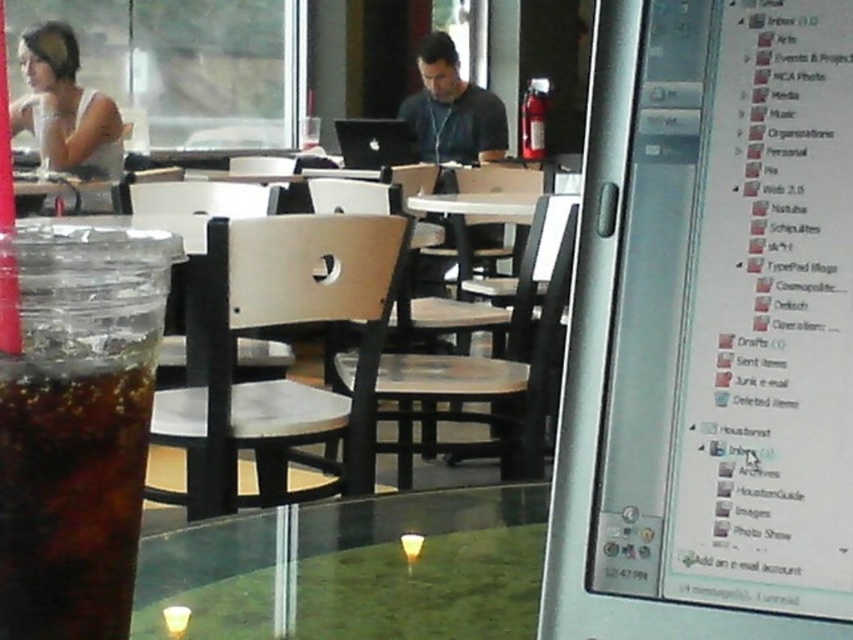
You are a customer sitting at the transparent glass table at center in a cafe. You notice a matte white shirt at upper left. Which object is closer to the ceiling?

The matte white shirt at upper left is closer to the ceiling because the transparent glass table at center is shorter than the matte white shirt at upper left.

You are sitting at the transparent glass table at center and want to wave to the person wearing the matte white shirt at upper left. In which direction should you wave your hand to face them?

You should wave your hand to the left because the transparent glass table at center is to the right of the matte white shirt at upper left, so the person is to your left.

You are a customer at the cafe and want to place your phone on the transparent glass table at center. However, you are wearing a matte black shirt at center. Considering the size of the table and your shirt, will your phone fit on the table without hanging off the edge?

The transparent glass table at center is narrower than the matte black shirt at center. Since the shirt is wider than the table, placing your phone on the table might cause it to hang off the edge if the shirt is covering part of the table.